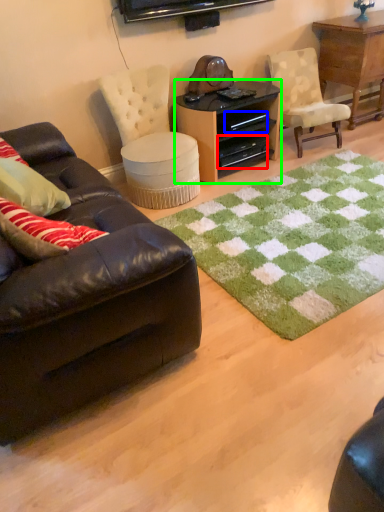
Question: Based on their relative distances, which object is farther from drawer (highlighted by a red box)? Choose from drawer (highlighted by a blue box) and desk (highlighted by a green box).

Choices:
 (A) drawer
 (B) desk

Answer: (A)